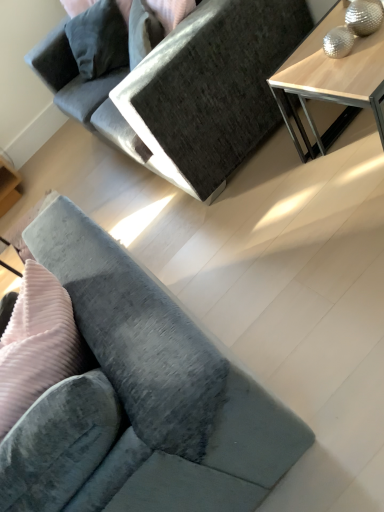
Locate an element on the screen. This screenshot has width=384, height=512. free point in front of velvet gray couch at center, the 1th studio couch positioned from the top is located at coordinates (258, 238).